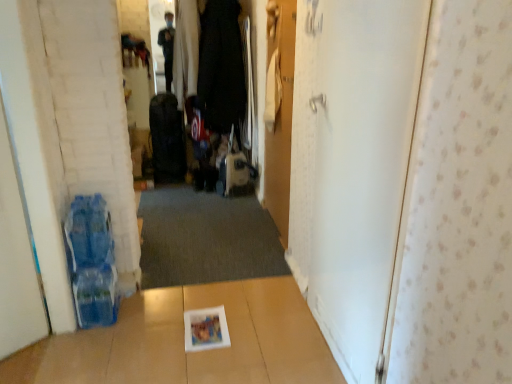
Question: Looking at their shapes, would you say white matte door at left, acting as the third door starting from the right, is wider or thinner than wooden door at center, acting as the second door starting from the right?

Choices:
 (A) wide
 (B) thin

Answer: (A)

Question: Considering the positions of white matte door at left, acting as the third door starting from the right, and wooden door at center, acting as the second door starting from the right, in the image, is white matte door at left, acting as the third door starting from the right, taller or shorter than wooden door at center, acting as the second door starting from the right,?

Choices:
 (A) short
 (B) tall

Answer: (A)

Question: Which object is the closest to the wooden door at center, the 2th door from the left?

Choices:
 (A) white matte door at left, which is the first door in left-to-right order
 (B) white matte door at right, which is the third door in left-to-right order
 (C) white glossy magazine at center
 (D) black fabric suitcase at center, the 1th luggage in the left-to-right sequence
 (E) matte black suitcase at center, arranged as the 1th luggage when viewed from the right

Answer: (E)

Question: Which object is the farthest from the wooden door at center, acting as the second door starting from the right?

Choices:
 (A) black fabric suitcase at center, the second luggage when ordered from right to left
 (B) matte black suitcase at center, which is counted as the second luggage, starting from the left
 (C) white matte door at left, which is the first door in left-to-right order
 (D) white glossy magazine at center
 (E) dark gray carpet at center

Answer: (C)